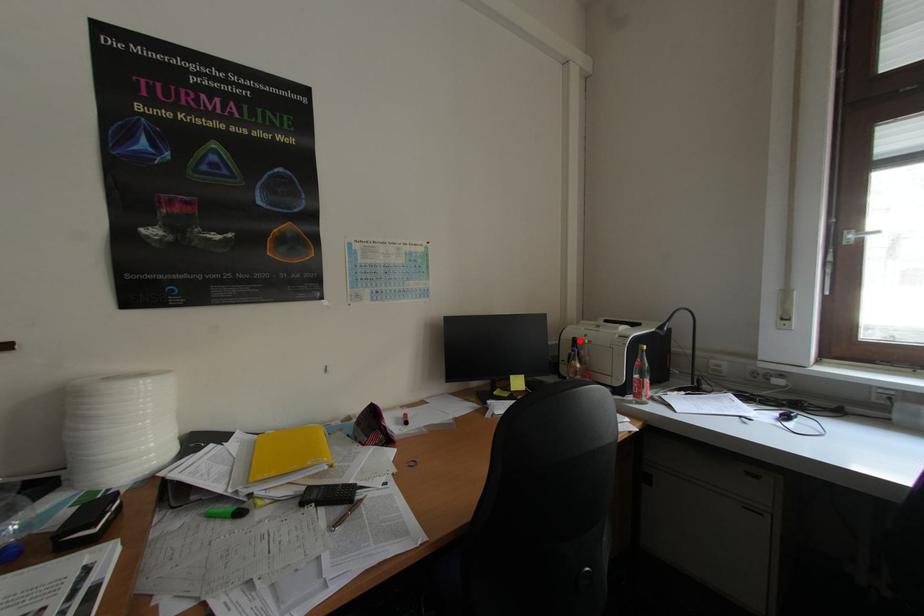
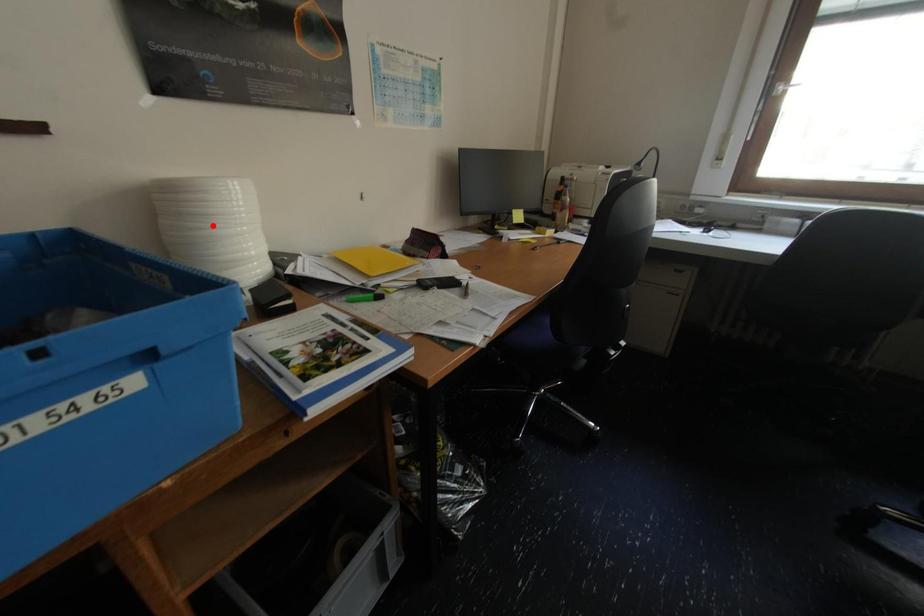
I am providing you with two images of the same scene from different viewpoints. A red point is marked on the first image and another point is marked on the second image. Is the marked point in image1 the same physical position as the marked point in image2?

No